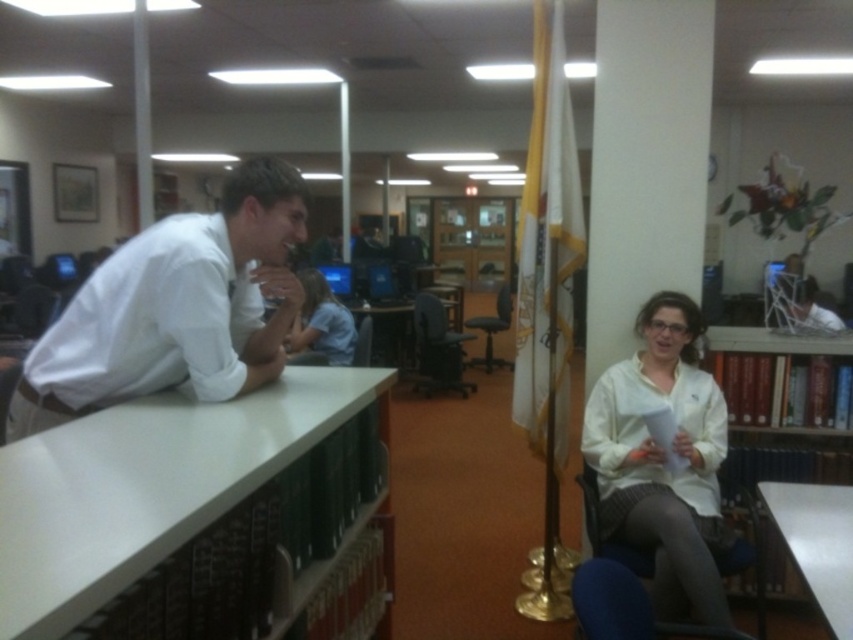
Question: Does white matte shirt at center have a smaller size compared to white glossy table at lower right?

Choices:
 (A) yes
 (B) no

Answer: (B)

Question: Observing the image, what is the correct spatial positioning of white glossy table at left in reference to white smooth shirt at left?

Choices:
 (A) above
 (B) below

Answer: (B)

Question: Which point is farther from the camera taking this photo?

Choices:
 (A) (753, 352)
 (B) (30, 403)
 (C) (692, 460)
 (D) (376, 333)

Answer: (D)

Question: Among these points, which one is nearest to the camera?

Choices:
 (A) (677, 436)
 (B) (848, 492)
 (C) (720, 368)

Answer: (B)

Question: Is white glossy table at left below light blue shirt at center?

Choices:
 (A) yes
 (B) no

Answer: (A)

Question: Which point appears farthest from the camera in this image?

Choices:
 (A) (693, 406)
 (B) (405, 332)
 (C) (192, 250)

Answer: (B)